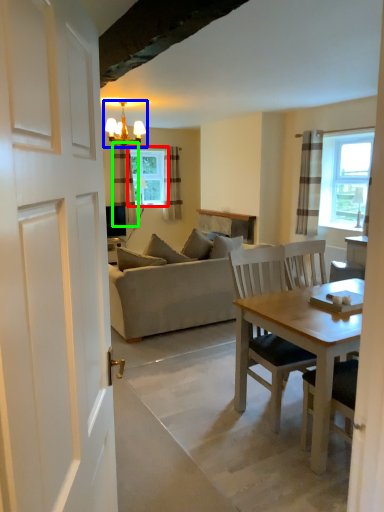
Question: Considering the real-world distances, which object is closest to window (highlighted by a red box)? light fixture (highlighted by a blue box) or curtain (highlighted by a green box).

Choices:
 (A) light fixture
 (B) curtain

Answer: (B)